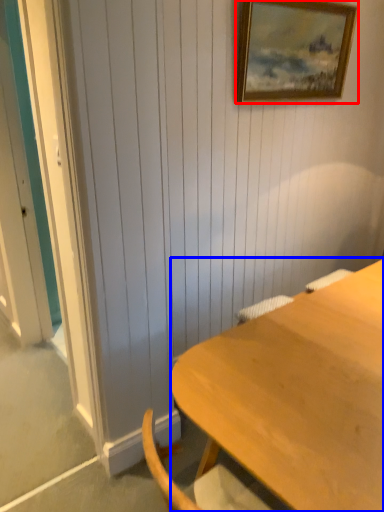
Question: Which of the following is the closest to the observer, picture frame (highlighted by a red box) or desk (highlighted by a blue box)?

Choices:
 (A) picture frame
 (B) desk

Answer: (B)